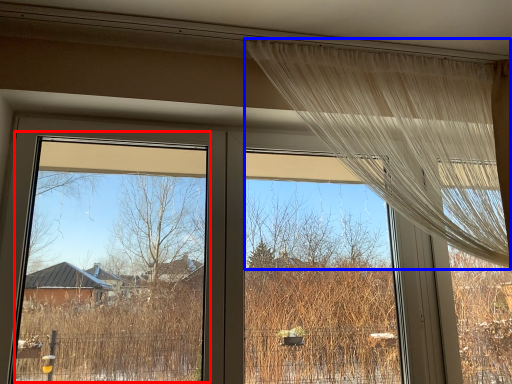
Question: Which of the following is the closest to the observer, window screen (highlighted by a red box) or curtain (highlighted by a blue box)?

Choices:
 (A) window screen
 (B) curtain

Answer: (A)